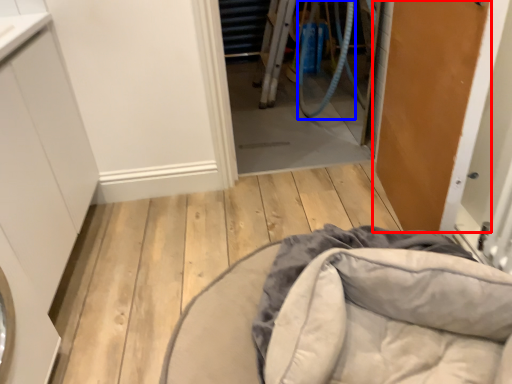
Question: Which object is further to the camera taking this photo, door (highlighted by a red box) or garden hose (highlighted by a blue box)?

Choices:
 (A) door
 (B) garden hose

Answer: (B)